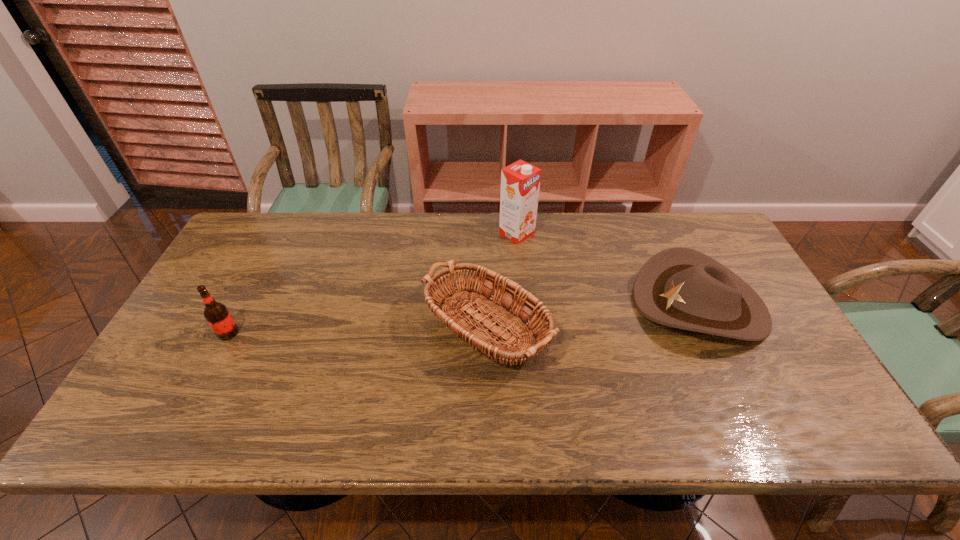
Find the location of a particular element. This screenshot has height=540, width=960. free space located 0.390m with a star on the front of the cowboy hat is located at coordinates (495, 304).

You are a GUI agent. You are given a task and a screenshot of the screen. Output one action in this format:
    pyautogui.click(x=<x>, y=<y>)
    Task: Click on the vacant area situated with a star on the front of the cowboy hat
    This screenshot has width=960, height=540.
    Given the screenshot: What is the action you would take?
    pyautogui.click(x=509, y=304)

Find the location of `object situated at the far edge`. object situated at the far edge is located at coordinates [x=520, y=181].

I want to click on object that is positioned at the near edge, so click(520, 345).

You are a GUI agent. You are given a task and a screenshot of the screen. Output one action in this format:
    pyautogui.click(x=<x>, y=<y>)
    Task: Click on the object situated at the left edge
    
    Given the screenshot: What is the action you would take?
    pyautogui.click(x=217, y=315)

I want to click on object present at the right edge, so click(x=678, y=287).

This screenshot has height=540, width=960. Find the location of `blank space at the far edge of the desktop`. blank space at the far edge of the desktop is located at coordinates (367, 236).

This screenshot has height=540, width=960. Identify the location of vacant space at the near edge of the desktop. (749, 431).

This screenshot has width=960, height=540. Identify the location of free space at the far left corner of the desktop. (252, 251).

In the image, there is a desktop. Identify the location of vacant space at the far right corner. (719, 251).